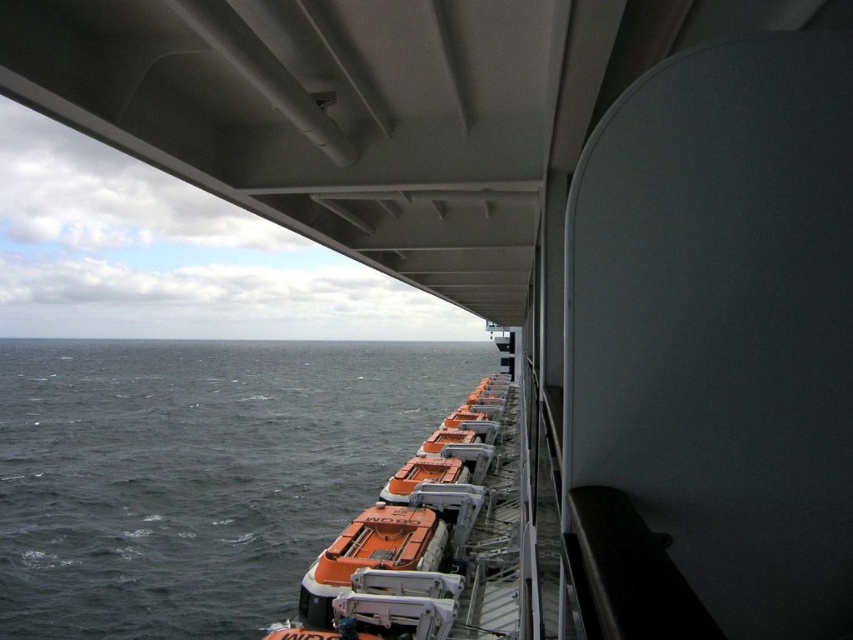
Question: Is dark gray water at lower left positioned at the back of orange matte lifeboats at center?

Choices:
 (A) no
 (B) yes

Answer: (B)

Question: Among these objects, which one is farthest from the camera?

Choices:
 (A) dark gray water at lower left
 (B) orange matte lifeboats at center

Answer: (A)

Question: Is dark gray water at lower left further to camera compared to orange matte lifeboats at center?

Choices:
 (A) yes
 (B) no

Answer: (A)

Question: Which object is closer to the camera taking this photo?

Choices:
 (A) orange matte lifeboats at center
 (B) dark gray water at lower left

Answer: (A)

Question: Can you confirm if dark gray water at lower left is positioned above orange matte lifeboats at center?

Choices:
 (A) yes
 (B) no

Answer: (B)